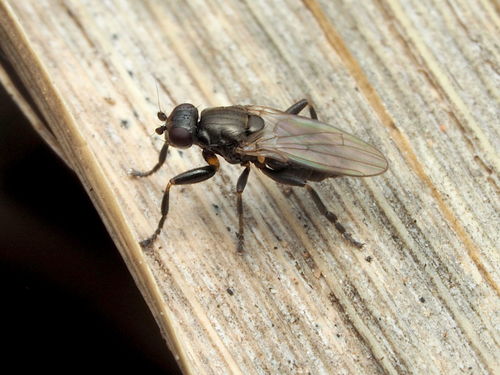
At what (x,y) coordinates should I click in order to perform the action: click on grooves between wood. Please return your answer as a coordinate pair (x, y). Looking at the image, I should click on pos(432,191), pos(299,234), pos(210,337), pos(416,69).